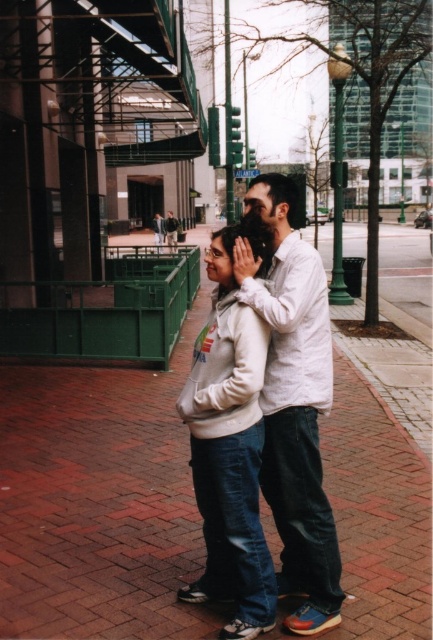
You are a photographer trying to capture a candid shot of two people in the scene. You want to ensure that both the white cotton shirt at center and the white fleece jacket at center are clearly visible in the frame. Based on their positions, which one should you focus on first to ensure it doesn t get cut off?

The white fleece jacket at center should be focused on first because the white cotton shirt at center is positioned to the right of it, meaning the shirt is closer to the edge of the frame. By prioritizing the jacket, you can adjust the framing to include both subjects without cutting off the shirt.

You are a photographer setting up a backdrop for a photoshoot. You need to ensure that the white cotton shirt at center and the white fleece jacket at center can fit side by side within a 1.2 meter wide backdrop. Based on their widths, will they both fit?

The white cotton shirt at center might be wider than white fleece jacket at center. If the total width of both items exceeds 1.2 meters, they may not fit side by side. However, without exact measurements, it is uncertain. Please verify the actual dimensions.

You are a photographer trying to capture a clear shot of both the white cotton shirt at center and the white fleece jacket at center. Since they are both white, you need to adjust your camera settings to ensure proper exposure. Which clothing item should you focus on first to avoid overexposing the white areas?

The white cotton shirt at center is positioned over the white fleece jacket at center, so focusing on the white cotton shirt at center first will help avoid overexposure as it is closer to the light source.